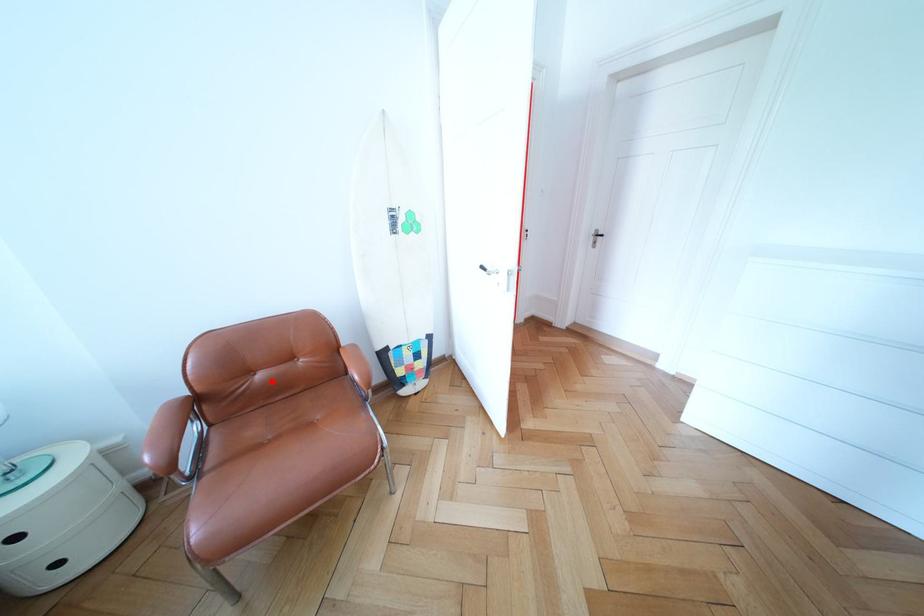
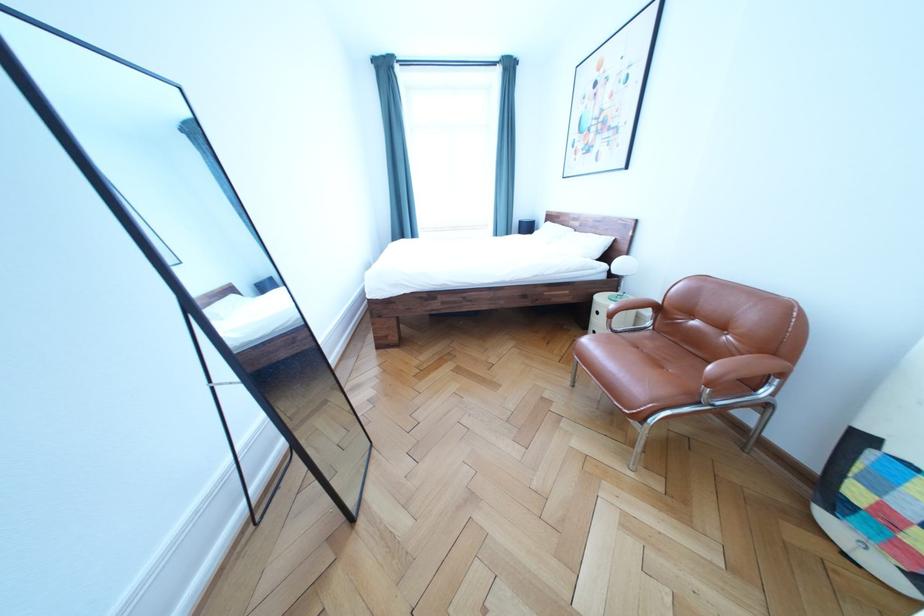
Locate, in the second image, the point that corresponds to the highlighted location in the first image.

(706, 329)